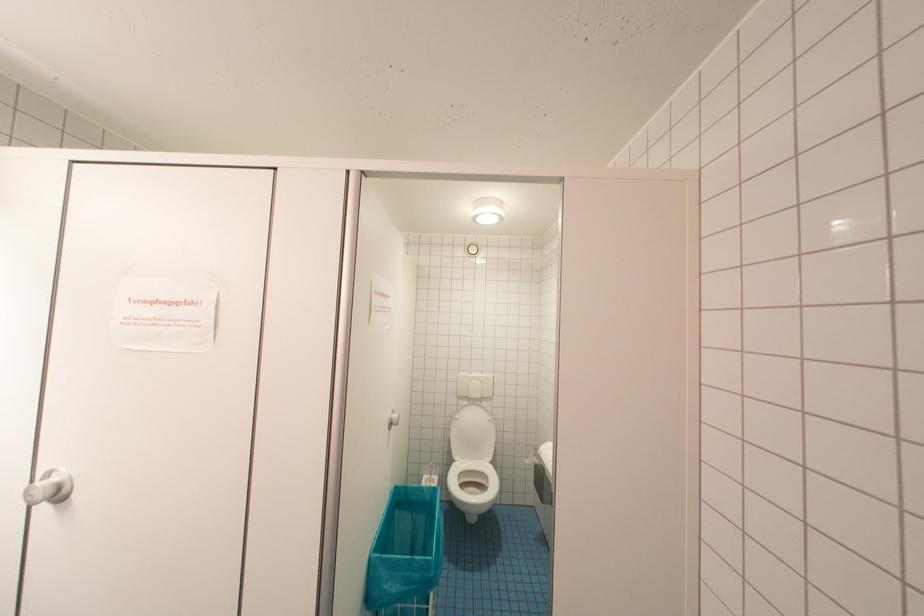
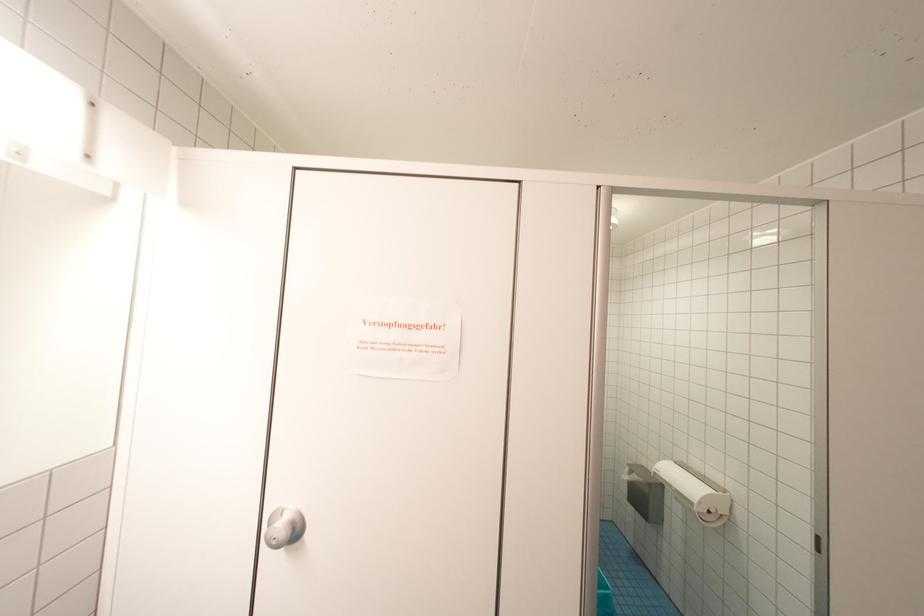
Question: Which direction would the cameraman need to move to produce the second image? Reply with the corresponding letter.

Choices:
 (A) Left
 (B) Right
 (C) Forward
 (D) Backward

Answer: (A)